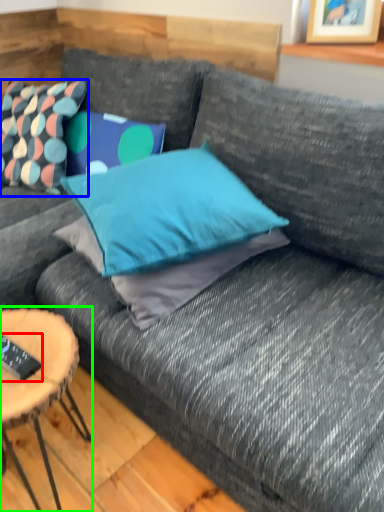
Question: Which is nearer to the remote control (highlighted by a red box)? pillow (highlighted by a blue box) or coffee table (highlighted by a green box).

Choices:
 (A) pillow
 (B) coffee table

Answer: (B)